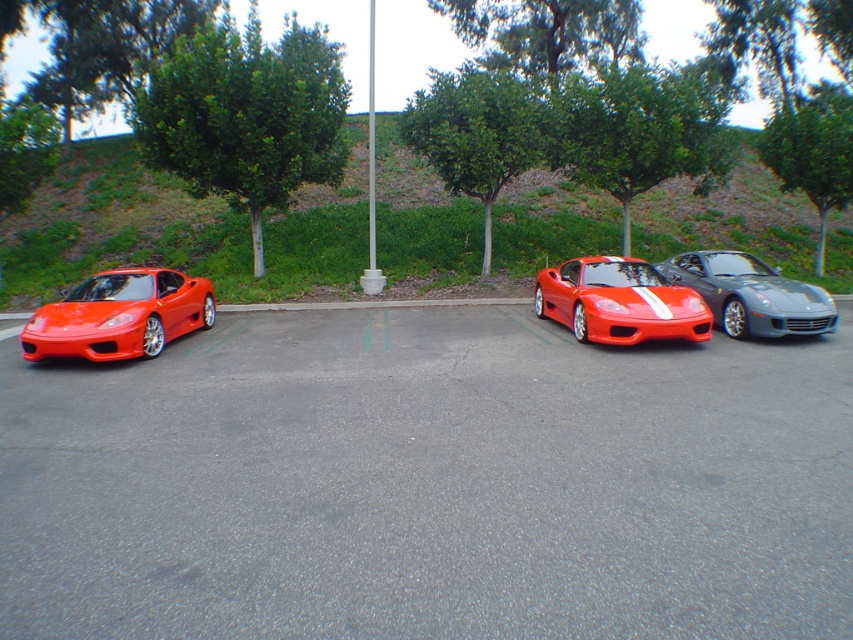
Question: Among these objects, which one is farthest from the camera?

Choices:
 (A) green grass at upper center
 (B) shiny metallic sports car at center right

Answer: (A)

Question: Is shiny red sports car at center closer to camera compared to shiny metallic sports car at center right?

Choices:
 (A) yes
 (B) no

Answer: (A)

Question: Which point is farther from the camera taking this photo?

Choices:
 (A) (598, 324)
 (B) (785, 291)
 (C) (785, 236)
 (D) (192, 298)

Answer: (C)

Question: Considering the relative positions of green grass at upper center and shiny red sports car at center in the image provided, where is green grass at upper center located with respect to shiny red sports car at center?

Choices:
 (A) below
 (B) above

Answer: (B)

Question: Which object is closer to the camera taking this photo?

Choices:
 (A) shiny metallic sports car at center right
 (B) shiny red sports car at center
 (C) green grass at upper center

Answer: (B)

Question: Is shiny red sports car at center positioned at the back of shiny metallic sports car at center right?

Choices:
 (A) no
 (B) yes

Answer: (A)